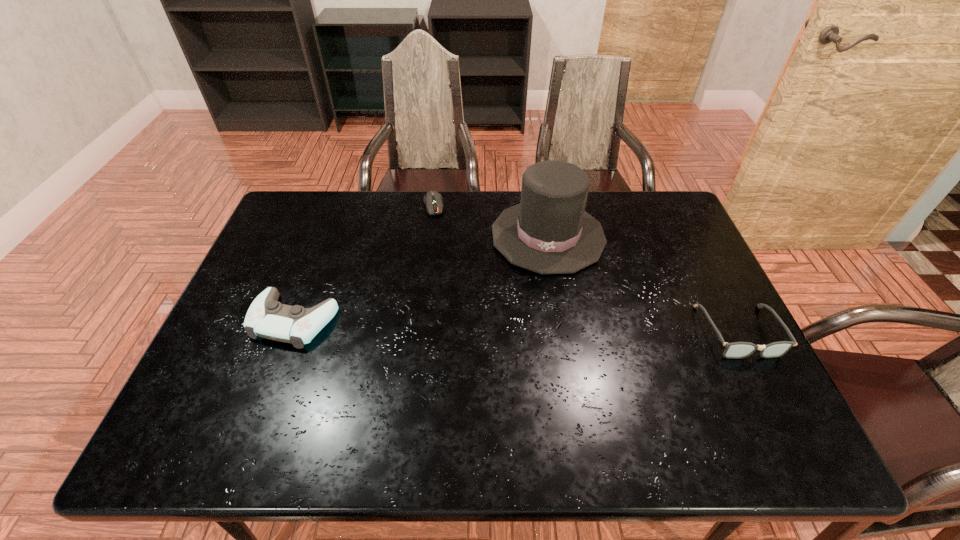
The height and width of the screenshot is (540, 960). Identify the location of free space on the desktop that is between the control and the rightmost object and is positioned on the front of the tallest object with the decoration. (533, 326).

What are the coordinates of `vacant space on the desktop that is between the control and the rightmost object and is positioned on the button of the computer equipment` in the screenshot? It's located at (455, 325).